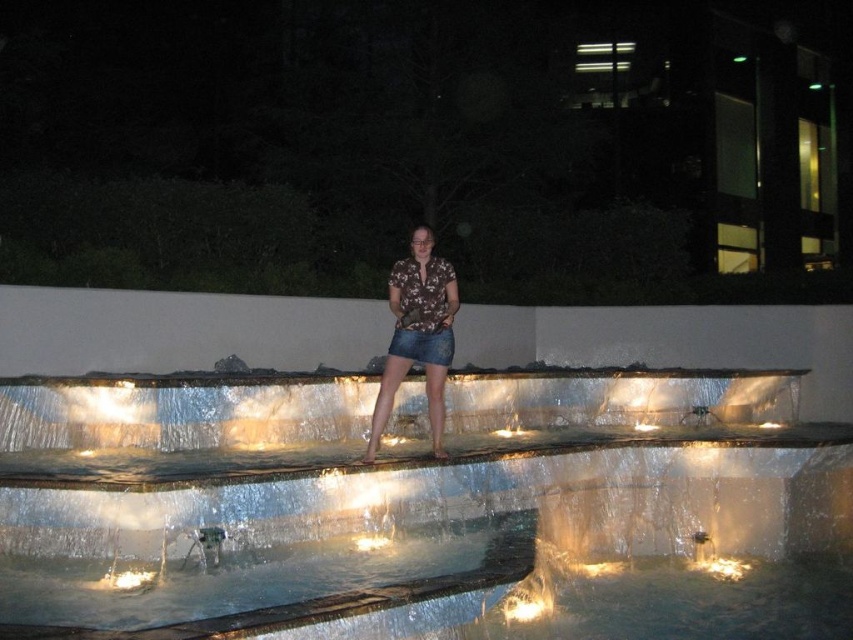
You are a photographer trying to capture the perfect shot of the brown floral shirt at center in the nighttime fountain scene. To ensure the shirt is well lit, you need to position your camera so that the light source is behind the shirt. Given the coordinates of the shirt at point 0.522, 0.490, where should you place your camera relative to this point to achieve the desired lighting?

The brown floral shirt at center is located at point (416, 333). To position the camera so the light source is behind the shirt, you should place the camera on the opposite side of the light source relative to the shirt. Since the scene has warm ambient lighting reflecting off the water, the light source is likely positioned behind the water feature. Therefore, placing the camera in front of the shirt, facing towards the light source, would ensure proper illumination.

You are a photographer setting up for a night shoot at the water feature. You want to capture the clear glass water at center in focus while keeping the background blurred. Given that the camera can only focus at a specific distance, what distance should you set the focus to?

You should set the focus distance to 14.47 feet because the clear glass water at center is located exactly at that distance from the camera, ensuring it will be in sharp focus while the background remains blurred.